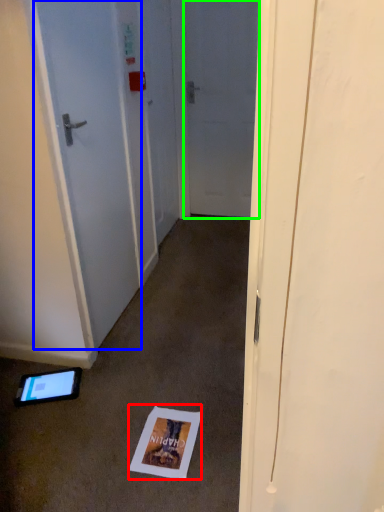
Question: Which is nearer to the postcard (highlighted by a red box)? door (highlighted by a blue box) or door (highlighted by a green box).

Choices:
 (A) door
 (B) door

Answer: (A)